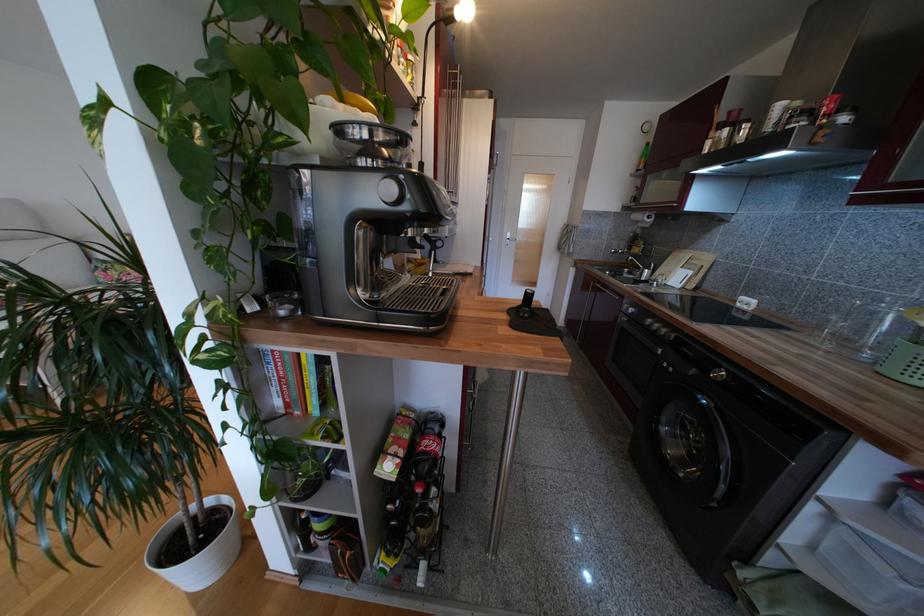
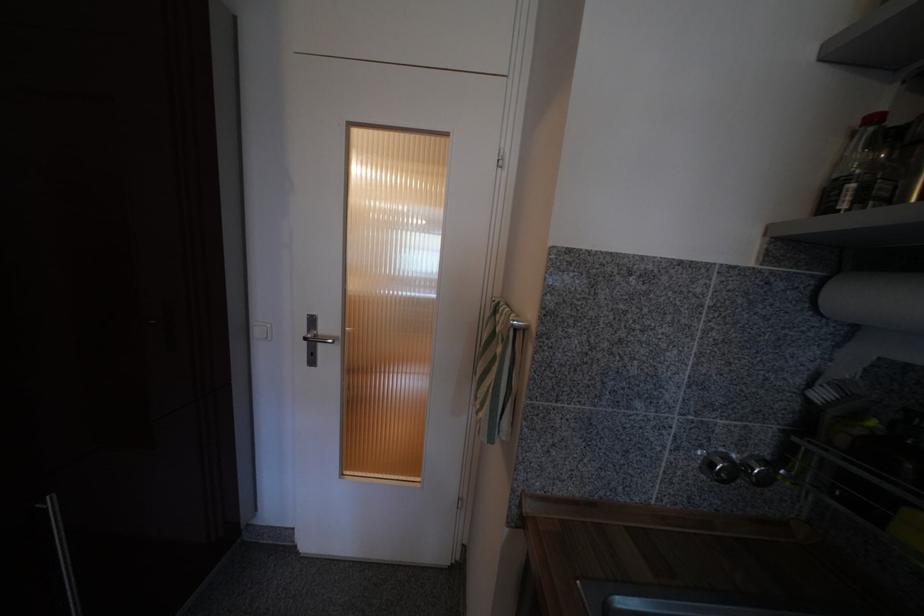
Find the pixel in the second image that matches (619,252) in the first image.

(730, 460)